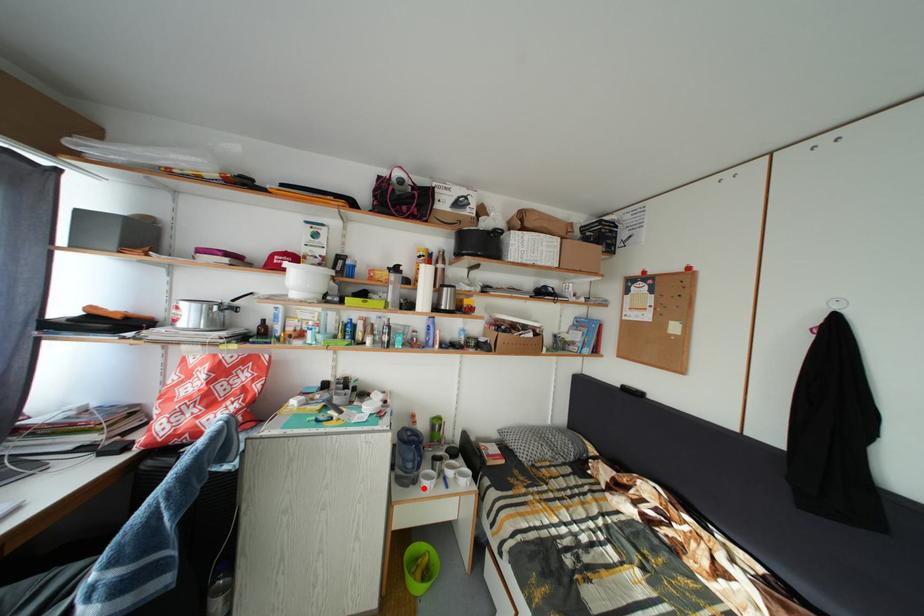
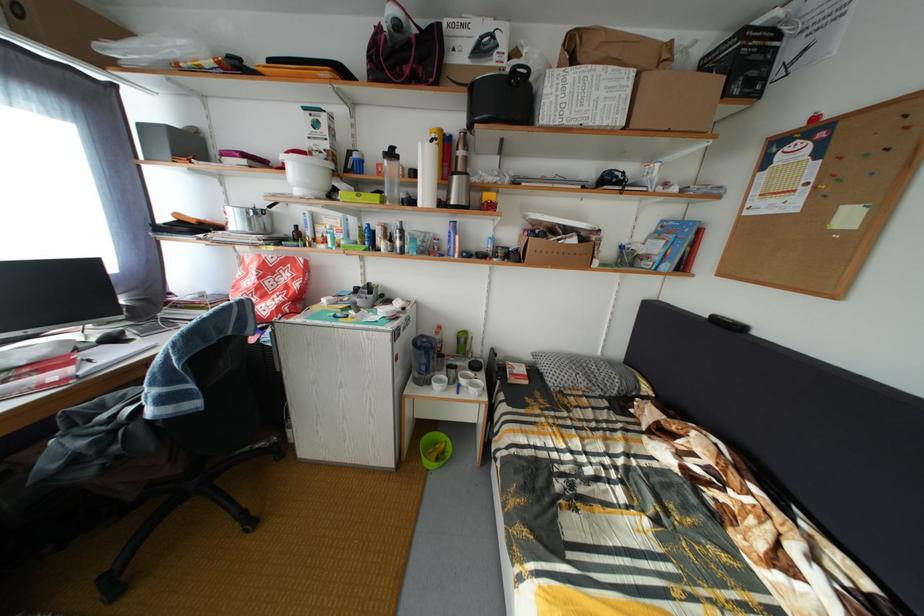
Question: I am providing you with two images of the same scene from different viewpoints. Image1 has a red point marked. In image2, the corresponding 3D location appears at what relative position? Reply with the corresponding letter.

Choices:
 (A) Closer
 (B) Farther

Answer: (A)